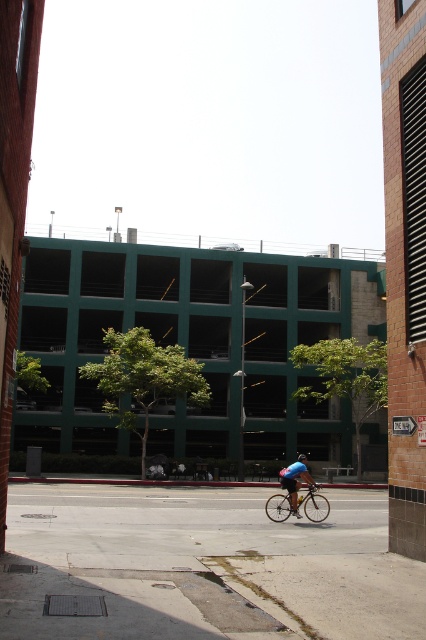
What is the exact coordinate of the gray concrete pavement at center in the image?

The gray concrete pavement at center is located at coordinate point (204,564).